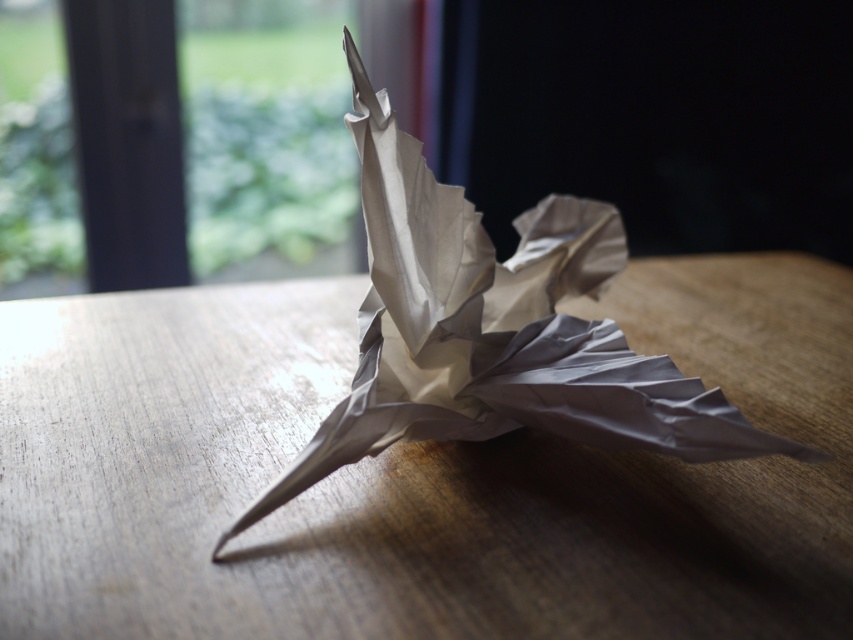
Question: Which point is closer to the camera?

Choices:
 (A) (173, 628)
 (B) (413, 371)

Answer: (A)

Question: Which object is closer to the camera taking this photo?

Choices:
 (A) matte paper bird at center
 (B) wooden table at center

Answer: (B)

Question: Can you confirm if wooden table at center is bigger than matte paper bird at center?

Choices:
 (A) yes
 (B) no

Answer: (A)

Question: Where is wooden table at center located in relation to matte paper bird at center in the image?

Choices:
 (A) above
 (B) below

Answer: (B)

Question: Which of the following is the closest to the observer?

Choices:
 (A) wooden table at center
 (B) matte paper bird at center

Answer: (A)

Question: Is wooden table at center positioned in front of matte paper bird at center?

Choices:
 (A) no
 (B) yes

Answer: (B)